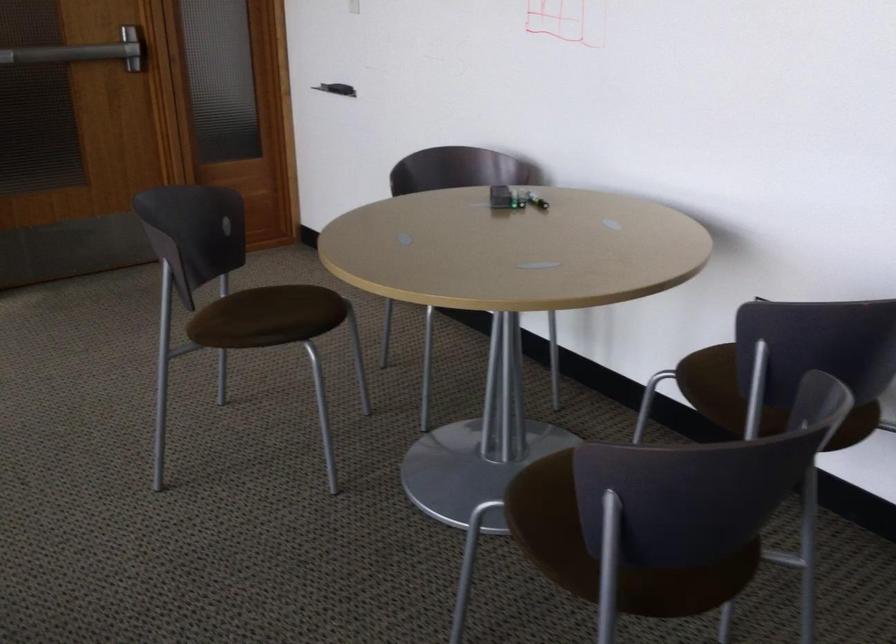
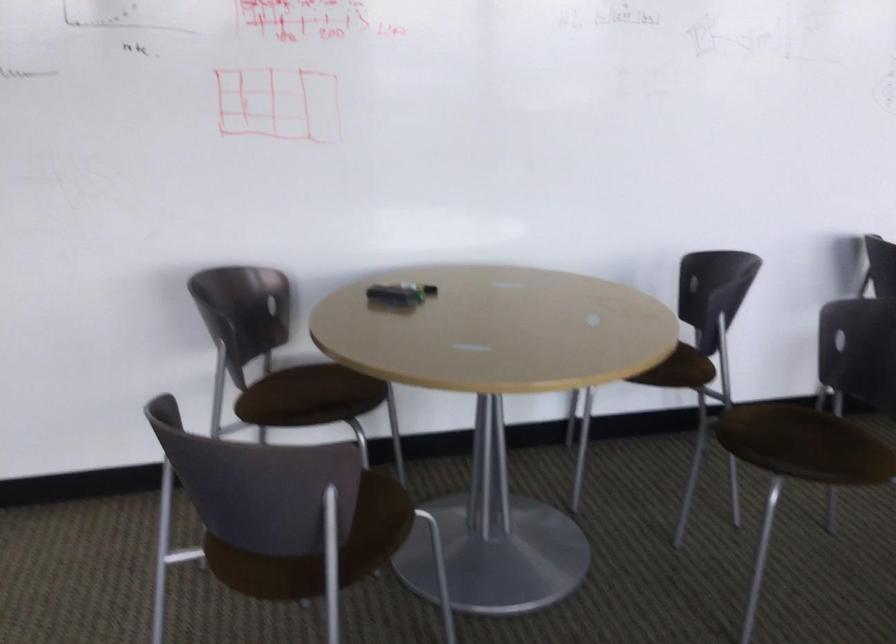
Where in the second image is the point corresponding to pixel 604 512 from the first image?

(798, 437)